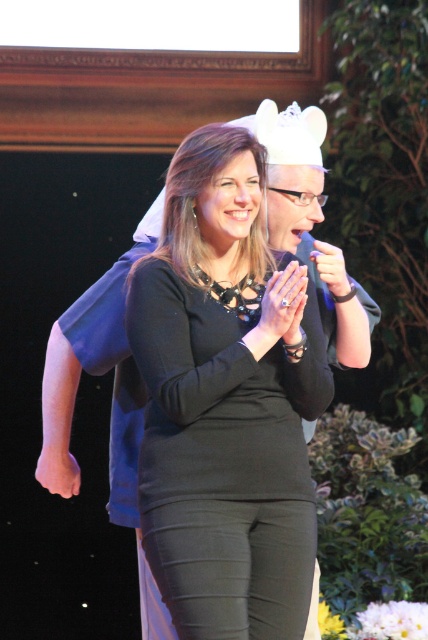
Question: Which of the following is the closest to the observer?

Choices:
 (A) black matte dress at center
 (B) smooth skin hand at center

Answer: (A)

Question: Can you confirm if smooth skin hand at center is positioned above matte black hand at center?

Choices:
 (A) no
 (B) yes

Answer: (A)

Question: Is black matte dress at center wider than silver metallic ring at center?

Choices:
 (A) no
 (B) yes

Answer: (B)

Question: Does black matte dress at center have a lesser width compared to smooth skin hand at center?

Choices:
 (A) no
 (B) yes

Answer: (A)

Question: Which point appears farthest from the camera in this image?

Choices:
 (A) (225, 154)
 (B) (330, 259)

Answer: (B)

Question: Which object is the closest to the smooth skin hand at center?

Choices:
 (A) black matte dress at center
 (B) silver metallic ring at center
 (C) matte black hand at center

Answer: (A)